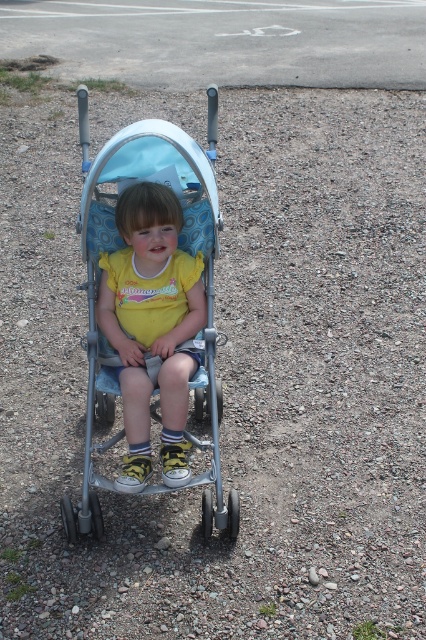
You are a parent trying to decide whether to use a stroller cover for the metallic silver stroller at center. The cover is designed to fit items smaller than the yellow matte shirt at center. Will the cover fit the stroller?

The metallic silver stroller at center is larger in size than the yellow matte shirt at center. Since the cover is designed for items smaller than the yellow matte shirt at center, it will not fit the stroller.

You are a photographer taking a picture of the stroller and the child. You notice two points on the gravel surface near the stroller. The first point is at coordinates point (x=203, y=234) and the second point is at point (x=155, y=184). Which point is closer to your camera?

Point (x=203, y=234) is further to the camera than point (x=155, y=184), so the second point is closer to the camera.

You are a delivery person trying to navigate through a narrow hallway. You see the metallic silver stroller at center and the yellow matte shirt at center in the image. Can you determine if the stroller will fit through the hallway if the shirt is placed on a shelf that is 1 meter wide?

The metallic silver stroller at center might be wider than yellow matte shirt at center, so it is uncertain if the stroller will fit through the hallway. The shirt on the shelf does not affect the stroller width.